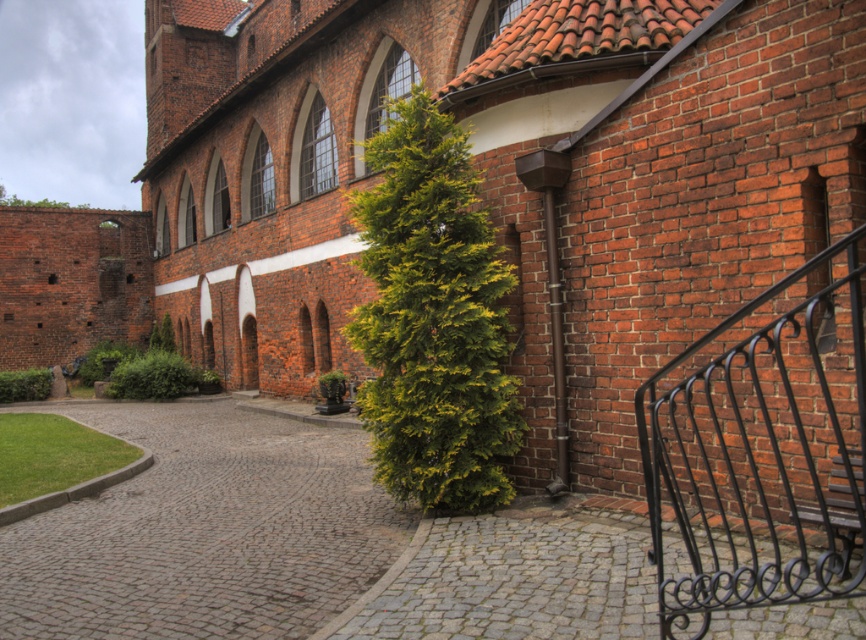
Question: Does brown cobblestone path at center have a smaller size compared to gray cobblestone path at lower center?

Choices:
 (A) yes
 (B) no

Answer: (B)

Question: Which of the following is the closest to the observer?

Choices:
 (A) (492, 566)
 (B) (818, 346)
 (C) (113, 513)

Answer: (B)

Question: Is black wrought iron balustrade at right smaller than gray cobblestone path at lower center?

Choices:
 (A) no
 (B) yes

Answer: (A)

Question: Can you confirm if black wrought iron balustrade at right is positioned to the right of gray cobblestone path at lower center?

Choices:
 (A) yes
 (B) no

Answer: (A)

Question: Estimate the real-world distances between objects in this image. Which object is closer to the black wrought iron balustrade at right?

Choices:
 (A) gray cobblestone path at lower center
 (B) brown cobblestone path at center

Answer: (A)

Question: Estimate the real-world distances between objects in this image. Which object is closer to the brown cobblestone path at center?

Choices:
 (A) black wrought iron balustrade at right
 (B) gray cobblestone path at lower center

Answer: (B)